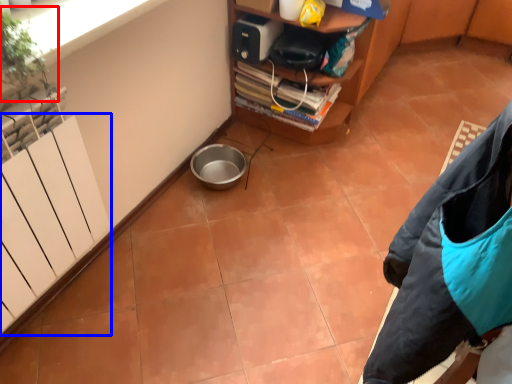
Question: Among these objects, which one is nearest to the camera, plant (highlighted by a red box) or radiator (highlighted by a blue box)?

Choices:
 (A) plant
 (B) radiator

Answer: (B)